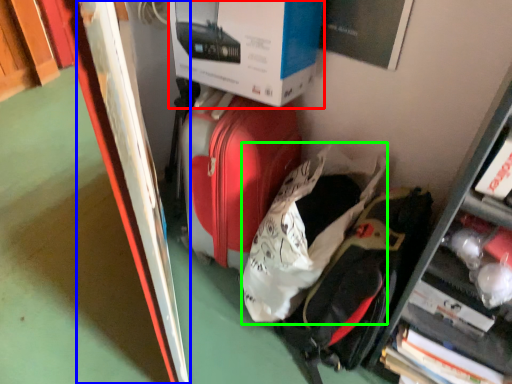
Question: Which object is the closest to the box (highlighted by a red box)? Choose among these: bulletin board (highlighted by a blue box) or luggage (highlighted by a green box).

Choices:
 (A) bulletin board
 (B) luggage

Answer: (A)